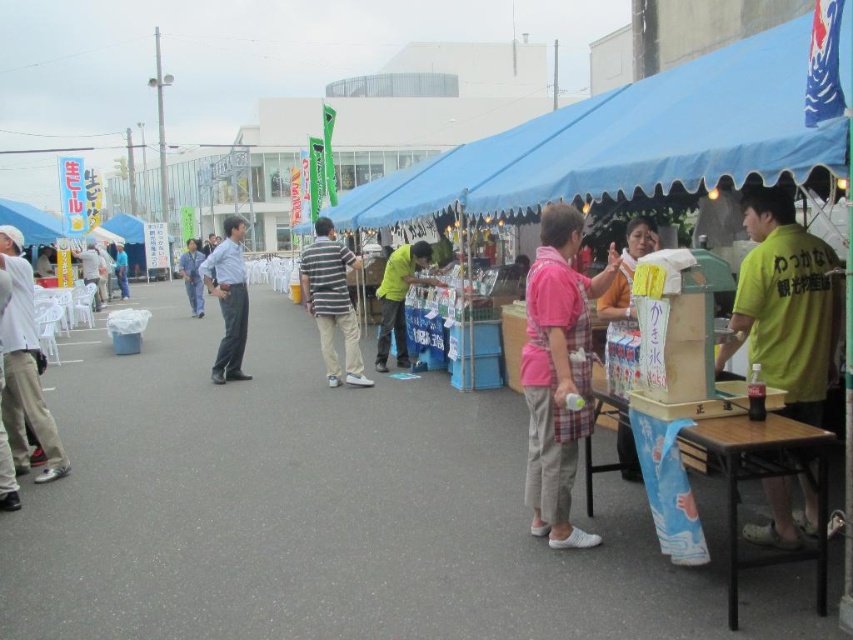
Between blue fabric canopy at upper right and yellow paper towel dispenser at center, which one appears on the left side from the viewer's perspective?

From the viewer's perspective, blue fabric canopy at upper right appears more on the left side.

Which is above, blue fabric canopy at upper right or yellow paper towel dispenser at center?

blue fabric canopy at upper right is above.

Between point (653, 144) and point (613, 300), which one is positioned behind?

The point (613, 300) is behind.

The image size is (853, 640). I want to click on blue fabric canopy at upper right, so click(630, 140).

Is blue fabric canopy at upper right smaller than blue denim jeans at center?

No, blue fabric canopy at upper right is not smaller than blue denim jeans at center.

Does blue fabric canopy at upper right have a greater height compared to blue denim jeans at center?

Yes.

Describe the element at coordinates (630, 140) in the screenshot. I see `blue fabric canopy at upper right` at that location.

Where is `blue fabric canopy at upper right`? The image size is (853, 640). blue fabric canopy at upper right is located at coordinates (630, 140).

Who is lower down, pink fabric shirt at center or light blue jeans at center?

Positioned lower is pink fabric shirt at center.

Is point (538, 486) in front of point (235, 300)?

Yes, it is.

Identify the location of pink fabric shirt at center. (556, 372).